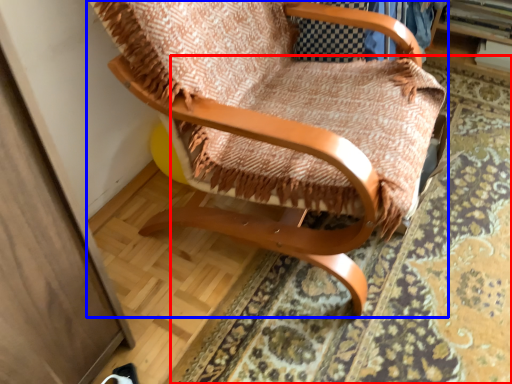
Question: Which point is closer to the camera, mat (highlighted by a red box) or chair (highlighted by a blue box)?

Choices:
 (A) mat
 (B) chair

Answer: (B)